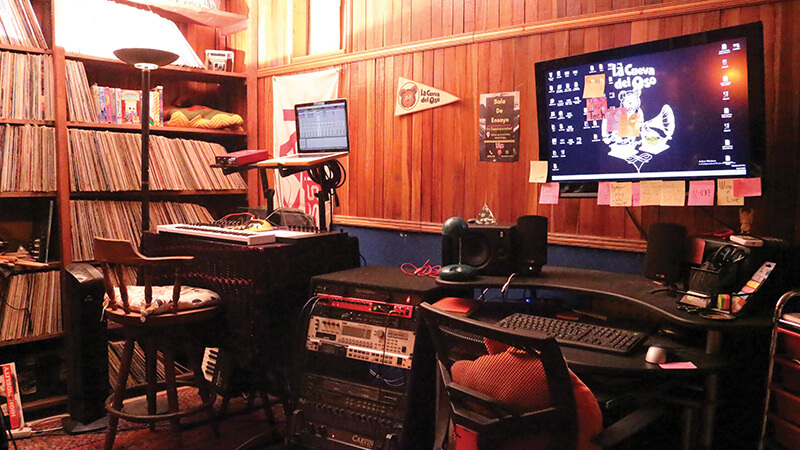
Find the location of `smallest lamp`. smallest lamp is located at coordinates (466, 269).